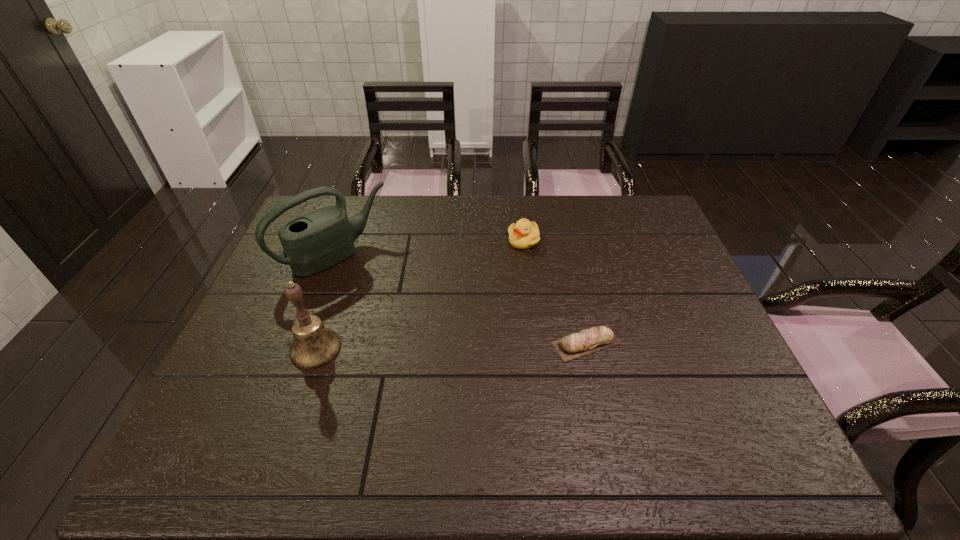
Where is `free space on the desktop that is between the bell and the pita bread and is positioned on the spout of the watering can`? free space on the desktop that is between the bell and the pita bread and is positioned on the spout of the watering can is located at coordinates (433, 346).

Identify the location of vacant spot on the desktop that is between the bell and the shortest object and is positioned at the face of the second shortest object. The image size is (960, 540). pos(454,346).